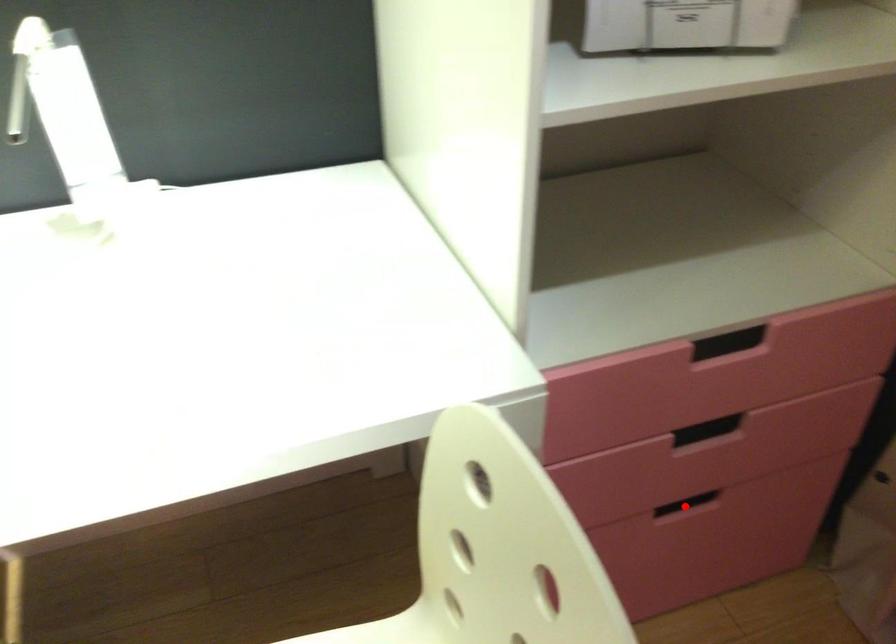
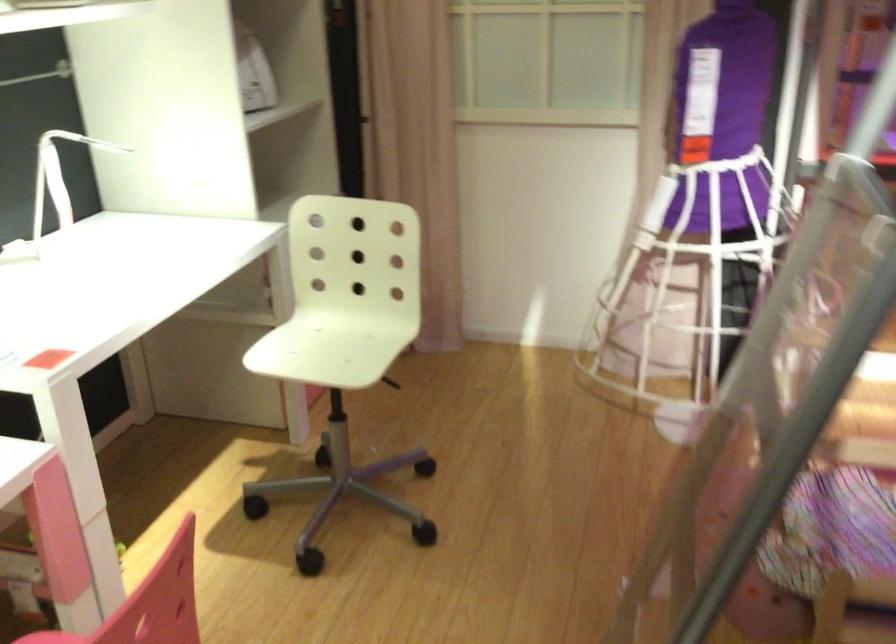
Question: I am providing you with two images of the same scene from different viewpoints. A red point is marked on the first image. Can you still see the location of the red point in image 2?

Choices:
 (A) Yes
 (B) No

Answer: (B)